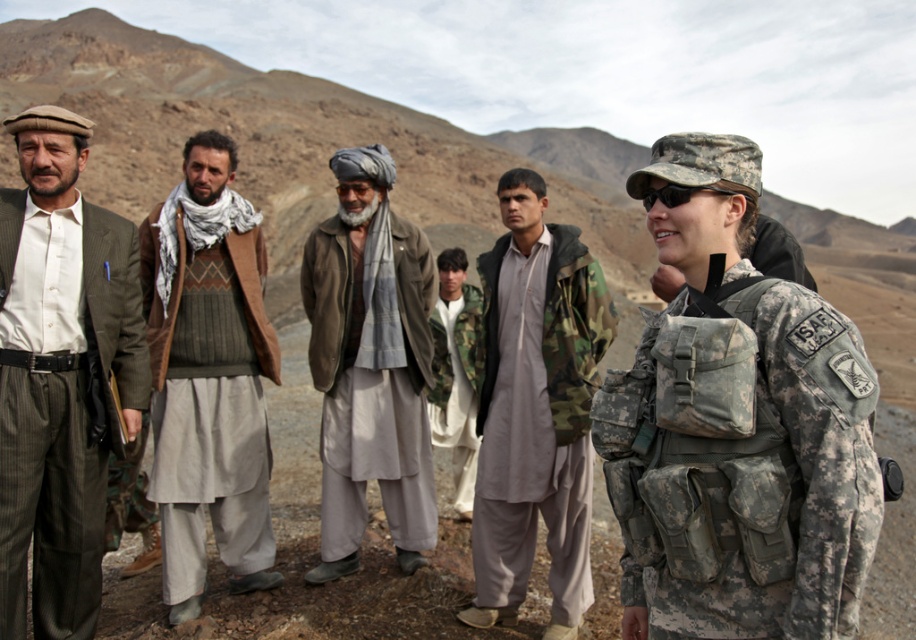
Is white shirt at center smaller than gray woolen jacket at center?

Yes, white shirt at center is smaller than gray woolen jacket at center.

The width and height of the screenshot is (916, 640). In order to click on white shirt at center in this screenshot , I will do `click(61, 376)`.

Where is `white shirt at center`? white shirt at center is located at coordinates click(61, 376).

Between point (29, 481) and point (444, 321), which one is positioned behind?

The point (444, 321) is behind.

Based on the photo, which of these two, white shirt at center or camouflage fabric jacket at center, stands taller?

white shirt at center is taller.

Does point (106, 388) come closer to viewer compared to point (454, 358)?

Yes, it is.

The height and width of the screenshot is (640, 916). Identify the location of white shirt at center. (61, 376).

Does point (478, 413) lie in front of point (303, 296)?

Yes, it is.

From the picture: Is camouflage jacket at center smaller than gray woolen jacket at center?

Indeed, camouflage jacket at center has a smaller size compared to gray woolen jacket at center.

The image size is (916, 640). What do you see at coordinates (536, 410) in the screenshot? I see `camouflage jacket at center` at bounding box center [536, 410].

This screenshot has height=640, width=916. Find the location of `camouflage jacket at center`. camouflage jacket at center is located at coordinates (536, 410).